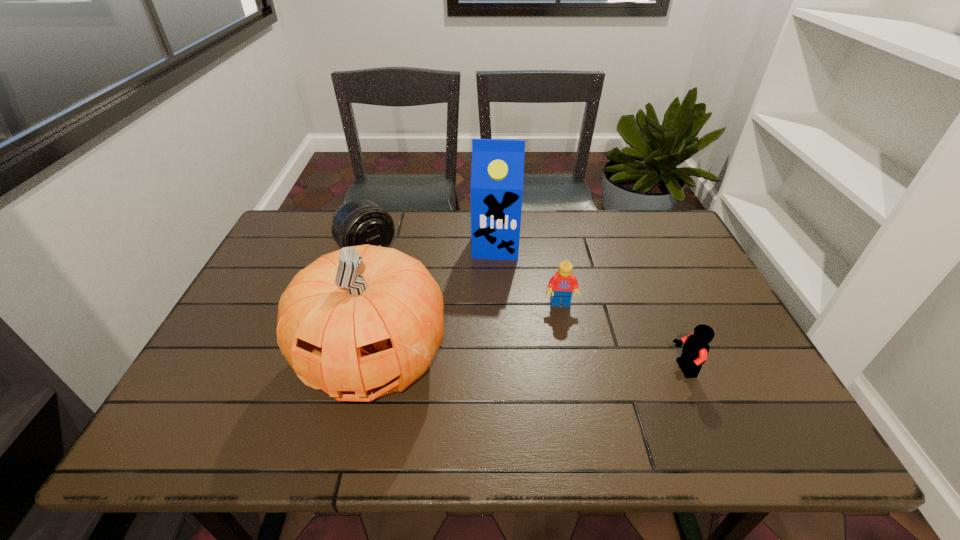
The image size is (960, 540). Identify the location of telephoto lens that is at the far edge. [359, 222].

This screenshot has height=540, width=960. In order to click on pumpkin at the near edge in this screenshot , I will do `click(362, 322)`.

You are a GUI agent. You are given a task and a screenshot of the screen. Output one action in this format:
    pyautogui.click(x=<x>, y=<y>)
    Task: Click on the Lego located at the near edge
    
    Given the screenshot: What is the action you would take?
    pyautogui.click(x=695, y=349)

Identify the location of object at the right edge. The height and width of the screenshot is (540, 960). (695, 349).

The image size is (960, 540). What are the coordinates of `object positioned at the near right corner` in the screenshot? It's located at (695, 349).

Locate an element on the screen. The image size is (960, 540). vacant region at the far edge of the desktop is located at coordinates (609, 210).

The image size is (960, 540). I want to click on free space at the near edge of the desktop, so click(548, 377).

Locate an element on the screen. The height and width of the screenshot is (540, 960). vacant space at the left edge is located at coordinates (310, 258).

The image size is (960, 540). I want to click on vacant space at the right edge, so click(x=715, y=368).

Locate an element on the screen. This screenshot has height=540, width=960. vacant area at the far right corner of the desktop is located at coordinates (677, 231).